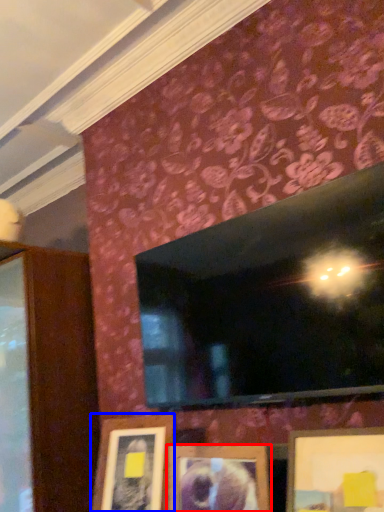
Question: Which object is closer to the camera taking this photo, picture frame (highlighted by a red box) or picture frame (highlighted by a blue box)?

Choices:
 (A) picture frame
 (B) picture frame

Answer: (A)